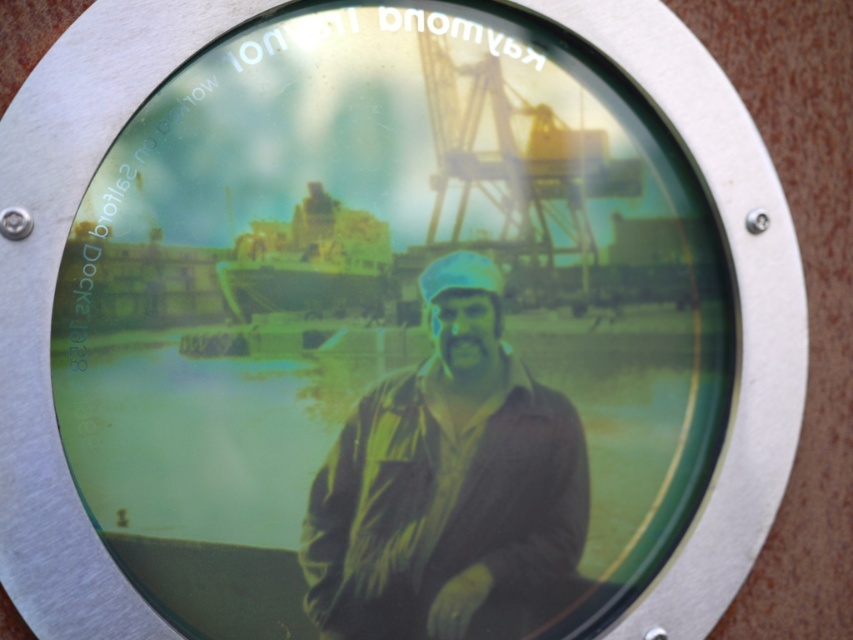
Which is more to the left, matte black jacket at center or yellow-green plastic boat at center?

From the viewer's perspective, yellow-green plastic boat at center appears more on the left side.

The height and width of the screenshot is (640, 853). I want to click on matte black jacket at center, so click(x=448, y=484).

Does point (448, 605) come closer to viewer compared to point (300, 246)?

No, (448, 605) is behind (300, 246).

This screenshot has width=853, height=640. In order to click on matte black jacket at center in this screenshot , I will do `click(448, 484)`.